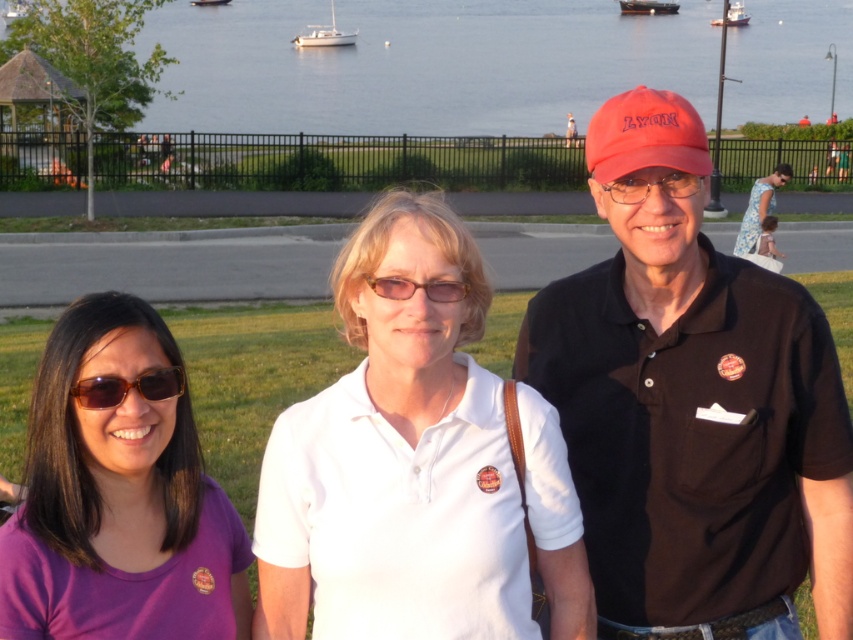
Is purple cotton polo shirt at lower left wider than white glossy sailboat at upper center?

No.

Does purple cotton polo shirt at lower left appear on the right side of white glossy sailboat at upper center?

Yes, purple cotton polo shirt at lower left is to the right of white glossy sailboat at upper center.

Does point (9, 570) lie in front of point (331, 42)?

That is True.

Where is `purple cotton polo shirt at lower left`? The image size is (853, 640). purple cotton polo shirt at lower left is located at coordinates (125, 584).

Can you confirm if blue water at center is positioned to the left of white plastic boat at upper center?

Yes, blue water at center is to the left of white plastic boat at upper center.

Where is `blue water at center`? blue water at center is located at coordinates (422, 65).

From the picture: Who is more distant from viewer, (x=798, y=113) or (x=732, y=20)?

The point (x=732, y=20) is behind.

Where is `blue water at center`? The image size is (853, 640). blue water at center is located at coordinates (422, 65).

Between translucent amber sunglasses at center and white plastic boat at center, which one has more height?

white plastic boat at center

Who is higher up, translucent amber sunglasses at center or white plastic boat at center?

white plastic boat at center is higher up.

Is point (122, 397) positioned in front of point (198, 3)?

Yes.

The width and height of the screenshot is (853, 640). What are the coordinates of `translucent amber sunglasses at center` in the screenshot? It's located at (128, 387).